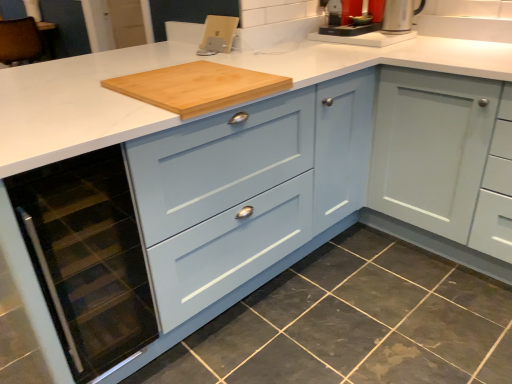
The height and width of the screenshot is (384, 512). I want to click on vacant area that lies to the right of matte glass oven at lower left, so click(x=194, y=354).